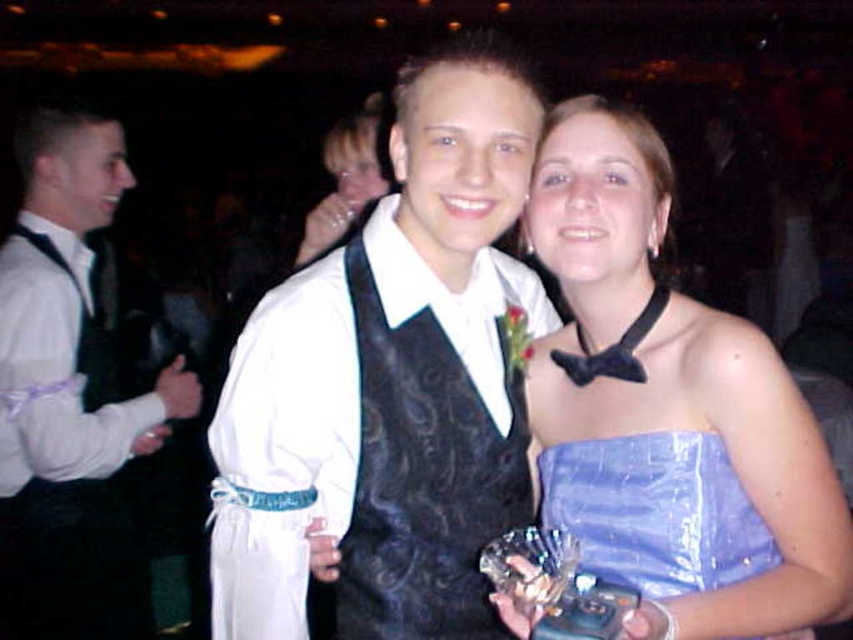
Question: Observing the image, what is the correct spatial positioning of black satin vest at center in reference to blue satin dress at center?

Choices:
 (A) above
 (B) below

Answer: (A)

Question: Considering the real-world distances, which object is closest to the blue satin dress at center?

Choices:
 (A) shiny blue fabric dress at center
 (B) matte black dress at center

Answer: (A)

Question: Is blue satin dress at center above black satin bow tie at upper center?

Choices:
 (A) no
 (B) yes

Answer: (A)

Question: Does matte black dress at center appear over black satin bow tie at upper center?

Choices:
 (A) yes
 (B) no

Answer: (A)

Question: Which point is farther to the camera?

Choices:
 (A) shiny blue fabric dress at center
 (B) white satin vest at left

Answer: (B)

Question: Which point is farther to the camera?

Choices:
 (A) shiny blue fabric dress at center
 (B) matte black dress at center
 (C) white satin vest at left
 (D) black satin vest at center

Answer: (B)